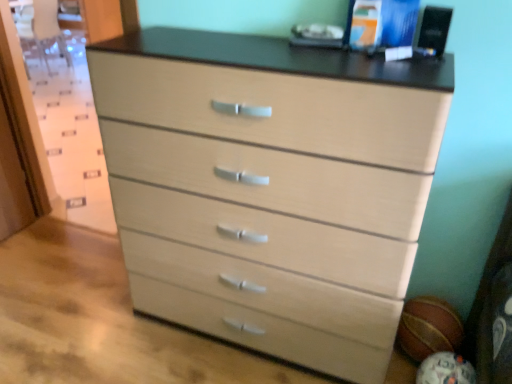
Find the location of a particular element. Image resolution: width=512 pixels, height=384 pixels. matte brown basketball at lower right, the 2th basketball positioned from the back is located at coordinates (445, 370).

Describe the element at coordinates (271, 186) in the screenshot. I see `light wood/texture chest of drawers at center` at that location.

You are a GUI agent. You are given a task and a screenshot of the screen. Output one action in this format:
    pyautogui.click(x=<x>, y=<y>)
    Task: Click on the rubber textured basketball at lower right, which is counted as the second basketball, starting from the front
    The height and width of the screenshot is (384, 512).
    Given the screenshot: What is the action you would take?
    pyautogui.click(x=428, y=328)

Find the location of a particular element. matte brown basketball at lower right, the first basketball in the front-to-back sequence is located at coordinates (445, 370).

Which is behind, point (428, 356) or point (380, 152)?

The point (428, 356) is farther.

How far apart are matte brown basketball at lower right, the 2th basketball positioned from the back, and light wood/texture chest of drawers at center?

28.95 inches.

Considering the relative sizes of matte brown basketball at lower right, the first basketball in the front-to-back sequence, and light wood/texture chest of drawers at center in the image provided, is matte brown basketball at lower right, the first basketball in the front-to-back sequence, thinner than light wood/texture chest of drawers at center?

Correct, the width of matte brown basketball at lower right, the first basketball in the front-to-back sequence, is less than that of light wood/texture chest of drawers at center.

From a real-world perspective, is matte brown basketball at lower right, the first basketball in the front-to-back sequence, physically above light wood/texture chest of drawers at center?

No.

Looking at this image, considering the sizes of light wood/texture chest of drawers at center and matte brown basketball at lower right, the 2th basketball positioned from the back, in the image, is light wood/texture chest of drawers at center bigger or smaller than matte brown basketball at lower right, the 2th basketball positioned from the back,?

Considering their sizes, light wood/texture chest of drawers at center takes up more space than matte brown basketball at lower right, the 2th basketball positioned from the back.

Could you tell me if light wood/texture chest of drawers at center is turned towards matte brown basketball at lower right, the 2th basketball positioned from the back?

No, light wood/texture chest of drawers at center is not oriented towards matte brown basketball at lower right, the 2th basketball positioned from the back.

From the image's perspective, does light wood/texture chest of drawers at center appear lower than matte brown basketball at lower right, the 2th basketball positioned from the back?

No, from the image's perspective, light wood/texture chest of drawers at center is not beneath matte brown basketball at lower right, the 2th basketball positioned from the back.

Is light wood/texture chest of drawers at center completely or partially outside of matte brown basketball at lower right, the 2th basketball positioned from the back?

Absolutely, light wood/texture chest of drawers at center is external to matte brown basketball at lower right, the 2th basketball positioned from the back.

Is rubber textured basketball at lower right, which is the first basketball from back to front, facing away from matte brown basketball at lower right, the first basketball in the front-to-back sequence?

No, rubber textured basketball at lower right, which is the first basketball from back to front, is not facing the opposite direction of matte brown basketball at lower right, the first basketball in the front-to-back sequence.

Is matte brown basketball at lower right, the first basketball in the front-to-back sequence, completely or partially inside rubber textured basketball at lower right, which is the first basketball from back to front?

No, matte brown basketball at lower right, the first basketball in the front-to-back sequence, is not a part of rubber textured basketball at lower right, which is the first basketball from back to front.

In terms of height, does rubber textured basketball at lower right, which is counted as the second basketball, starting from the front, look taller or shorter compared to matte brown basketball at lower right, the first basketball in the front-to-back sequence?

rubber textured basketball at lower right, which is counted as the second basketball, starting from the front, is shorter than matte brown basketball at lower right, the first basketball in the front-to-back sequence.

How different are the orientations of light wood/texture chest of drawers at center and rubber textured basketball at lower right, which is counted as the second basketball, starting from the front, in degrees?

The facing directions of light wood/texture chest of drawers at center and rubber textured basketball at lower right, which is counted as the second basketball, starting from the front, are 1.95 degrees apart.

From a real-world perspective, count 1st basketballs downward from the light wood/texture chest of drawers at center and point to it. Please provide its 2D coordinates.

[(428, 328)]

Visually, is light wood/texture chest of drawers at center positioned to the left or to the right of rubber textured basketball at lower right, which is the first basketball from back to front?

light wood/texture chest of drawers at center is positioned on rubber textured basketball at lower right, which is the first basketball from back to front,'s left side.

In the scene shown: In terms of height, does light wood/texture chest of drawers at center look taller or shorter compared to rubber textured basketball at lower right, which is counted as the second basketball, starting from the front?

light wood/texture chest of drawers at center is taller than rubber textured basketball at lower right, which is counted as the second basketball, starting from the front.

Consider the image. Is rubber textured basketball at lower right, which is the first basketball from back to front, at the left side of light wood/texture chest of drawers at center?

No.

Is rubber textured basketball at lower right, which is the first basketball from back to front, thinner than light wood/texture chest of drawers at center?

Yes, rubber textured basketball at lower right, which is the first basketball from back to front, is thinner than light wood/texture chest of drawers at center.

From the image's perspective, between rubber textured basketball at lower right, which is the first basketball from back to front, and light wood/texture chest of drawers at center, who is located below?

rubber textured basketball at lower right, which is the first basketball from back to front, is shown below in the image.

Is matte brown basketball at lower right, the first basketball in the front-to-back sequence, in front of or behind rubber textured basketball at lower right, which is the first basketball from back to front, in the image?

Clearly, matte brown basketball at lower right, the first basketball in the front-to-back sequence, is in front of rubber textured basketball at lower right, which is the first basketball from back to front.

From their relative heights in the image, would you say matte brown basketball at lower right, the first basketball in the front-to-back sequence, is taller or shorter than rubber textured basketball at lower right, which is the first basketball from back to front?

Considering their sizes, matte brown basketball at lower right, the first basketball in the front-to-back sequence, has more height than rubber textured basketball at lower right, which is the first basketball from back to front.

From a real-world perspective, is matte brown basketball at lower right, the first basketball in the front-to-back sequence, beneath rubber textured basketball at lower right, which is counted as the second basketball, starting from the front?

Indeed, from a real-world perspective, matte brown basketball at lower right, the first basketball in the front-to-back sequence, is positioned beneath rubber textured basketball at lower right, which is counted as the second basketball, starting from the front.

From a real-world perspective, count 2nd basketballs downward from the light wood/texture chest of drawers at center and point to it. Please provide its 2D coordinates.

[(445, 370)]

The height and width of the screenshot is (384, 512). Find the location of `chest of drawers on the left of matte brown basketball at lower right, the 2th basketball positioned from the back`. chest of drawers on the left of matte brown basketball at lower right, the 2th basketball positioned from the back is located at coordinates (271, 186).

From the image, which object appears to be nearer to matte brown basketball at lower right, the 2th basketball positioned from the back, light wood/texture chest of drawers at center or rubber textured basketball at lower right, which is counted as the second basketball, starting from the front?

rubber textured basketball at lower right, which is counted as the second basketball, starting from the front, is closer to matte brown basketball at lower right, the 2th basketball positioned from the back.

Estimate the real-world distances between objects in this image. Which object is closer to rubber textured basketball at lower right, which is the first basketball from back to front, matte brown basketball at lower right, the first basketball in the front-to-back sequence, or light wood/texture chest of drawers at center?

Based on the image, matte brown basketball at lower right, the first basketball in the front-to-back sequence, appears to be nearer to rubber textured basketball at lower right, which is the first basketball from back to front.

Based on their spatial positions, is rubber textured basketball at lower right, which is counted as the second basketball, starting from the front, or light wood/texture chest of drawers at center closer to matte brown basketball at lower right, the first basketball in the front-to-back sequence?

rubber textured basketball at lower right, which is counted as the second basketball, starting from the front, lies closer to matte brown basketball at lower right, the first basketball in the front-to-back sequence, than the other object.

Estimate the real-world distances between objects in this image. Which object is closer to light wood/texture chest of drawers at center, rubber textured basketball at lower right, which is counted as the second basketball, starting from the front, or matte brown basketball at lower right, the 2th basketball positioned from the back?

rubber textured basketball at lower right, which is counted as the second basketball, starting from the front, is closer to light wood/texture chest of drawers at center.

Considering their positions, is light wood/texture chest of drawers at center positioned further to rubber textured basketball at lower right, which is the first basketball from back to front, than matte brown basketball at lower right, the first basketball in the front-to-back sequence?

light wood/texture chest of drawers at center.

Based on the photo, looking at the image, which one is located closer to light wood/texture chest of drawers at center, matte brown basketball at lower right, the 2th basketball positioned from the back, or rubber textured basketball at lower right, which is the first basketball from back to front?

rubber textured basketball at lower right, which is the first basketball from back to front, lies closer to light wood/texture chest of drawers at center than the other object.

Find the location of `basketball between light wood/texture chest of drawers at center and rubber textured basketball at lower right, which is counted as the second basketball, starting from the front`. basketball between light wood/texture chest of drawers at center and rubber textured basketball at lower right, which is counted as the second basketball, starting from the front is located at coordinates (445, 370).